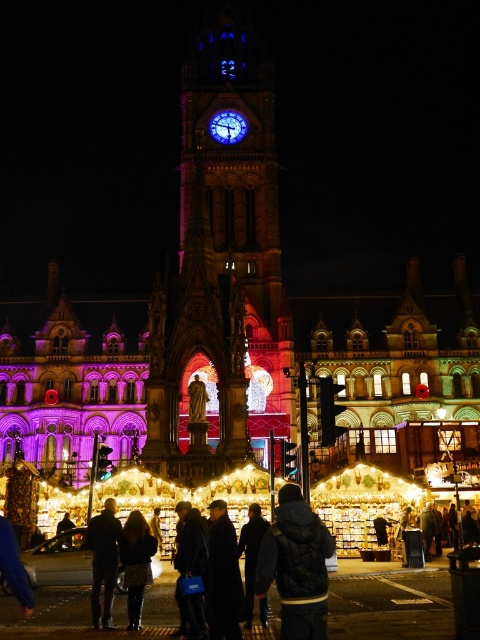
What object is located at the coordinates point (220, 266) in the image?

The point (220, 266) indicates the brick clock tower at center.

You are standing in the nighttime scene with the historic clock tower. You see two points marked in the image. Which point is closer to you, point [233,90] or point [262,618]?

Point [233,90] is closer to you because it is further to the viewer than point [262,618].